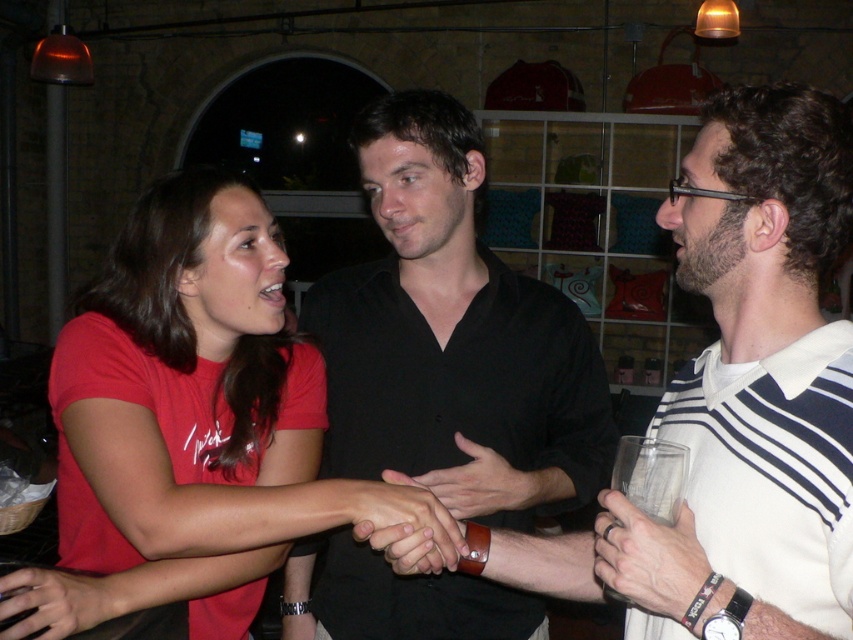
You are a photographer trying to capture a candid shot of the smooth leather wristband at center and the matte red shirt at lower left. Since the wristband is much taller than the shirt, how should you adjust your camera angle to ensure both are in focus?

Since the smooth leather wristband at center is much taller than the matte red shirt at lower left, you should angle your camera upwards to include the full height of the wristband while still capturing the shirt in the frame.

You are a delivery robot that is 24 inches wide. You need to move from the smooth leather wristband at lower right to the matte red shirt at lower left. Can you pass through the space between them without moving either object?

The smooth leather wristband at lower right is 24.37 inches away from the matte red shirt at lower left. Since the distance between them is greater than your width of 24 inches, you can pass through the space between them without moving either object.